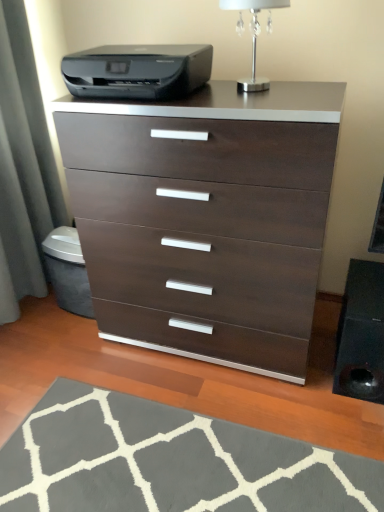
Identify the location of free area below gray soft rug at lower center (from a real-world perspective). (176, 463).